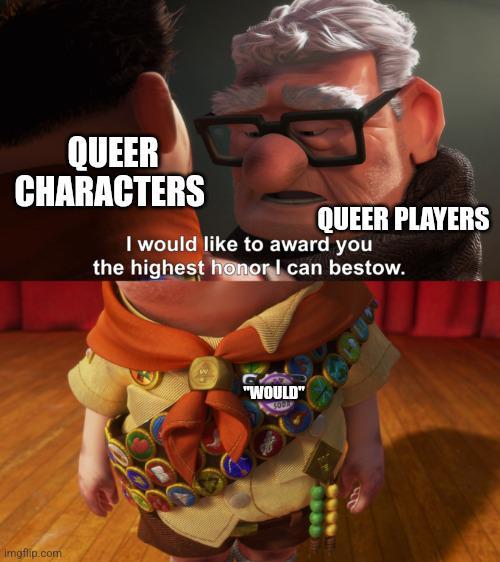
This screenshot has width=500, height=562. Find the location of `floor`. floor is located at coordinates (449, 480).